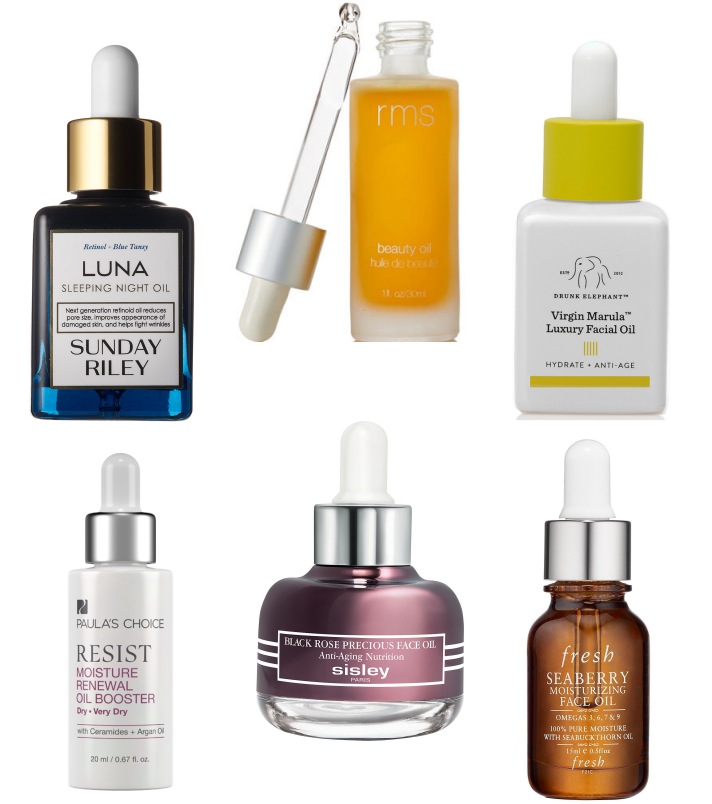
Where is `bottle`? bottle is located at coordinates (600, 670), (392, 624), (142, 649), (115, 354), (401, 238), (602, 265).